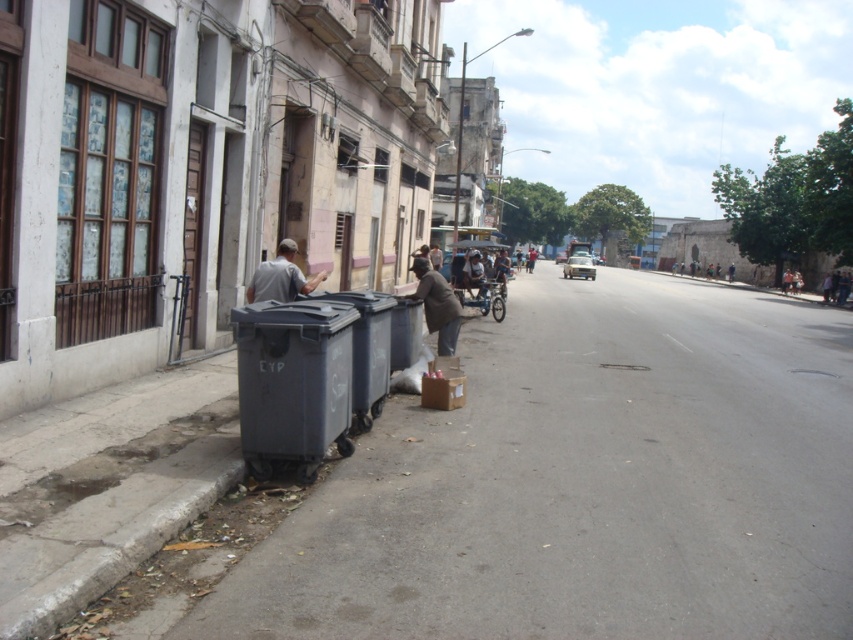
In the scene shown: You are a delivery person trying to park your bike between the matte black trash can at lower left and the gray concrete curb at lower left. Based on their positions, which side of the curb should you place your bike?

The matte black trash can at lower left is to the right of the gray concrete curb at lower left, so you should place your bike to the left side of the curb to fit between them.

You are a delivery person trying to navigate through the street scene. You need to place a large package on the gray concrete pavement at lower left without it overlapping the gray matte shirt at center. Given their sizes, is this possible?

The gray concrete pavement at lower left is wider than the gray matte shirt at center, so placing the package there without overlapping should be possible.